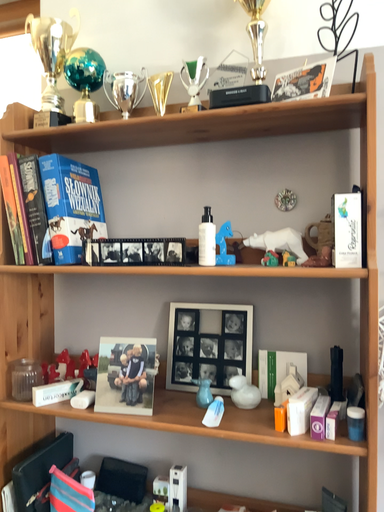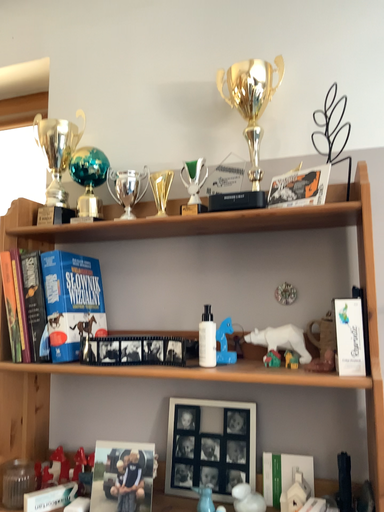
Question: How did the camera likely rotate when shooting the video?

Choices:
 (A) rotated upward
 (B) rotated downward

Answer: (A)